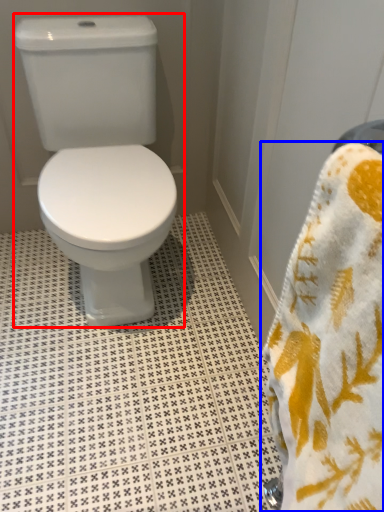
Question: Which of the following is the closest to the observer, toilet (highlighted by a red box) or towel (highlighted by a blue box)?

Choices:
 (A) toilet
 (B) towel

Answer: (B)